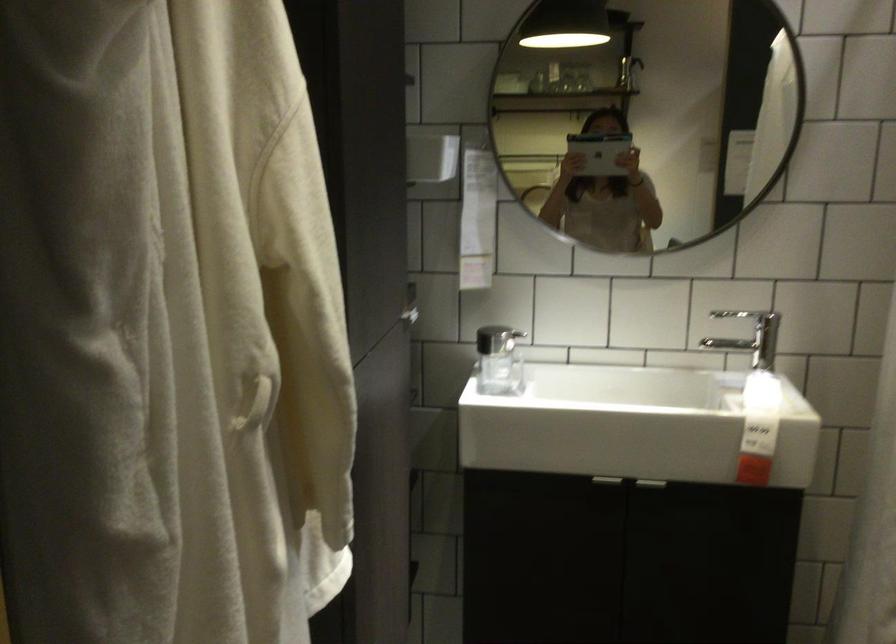
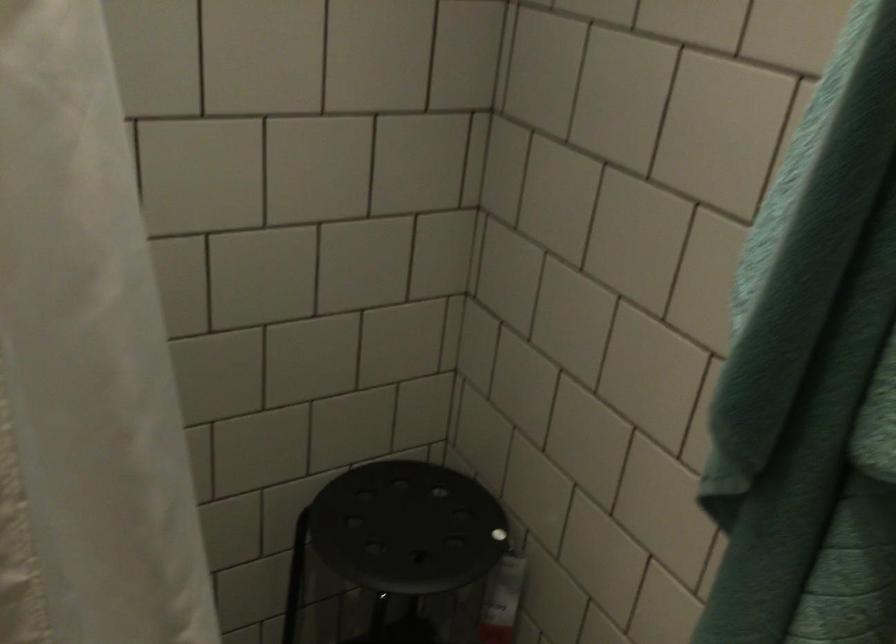
The images are taken continuously from a first-person perspective. In which direction is your viewpoint rotating?

The rotation direction of the camera is right-down.